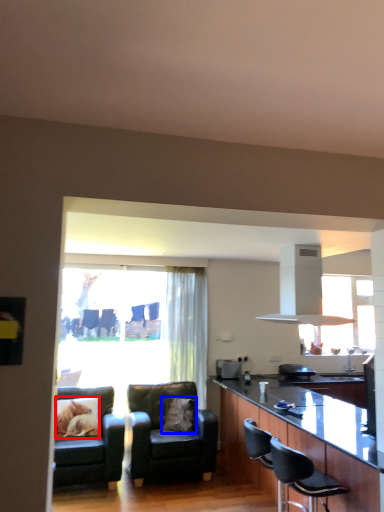
Question: Which object is closer to the camera taking this photo, pillow (highlighted by a red box) or pillow (highlighted by a blue box)?

Choices:
 (A) pillow
 (B) pillow

Answer: (A)